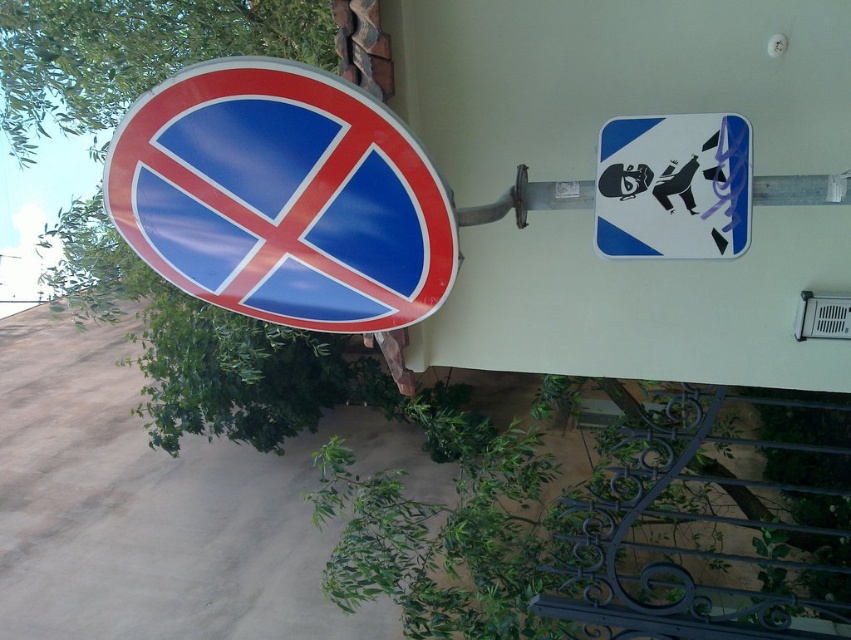
Question: Is shiny plastic sign at left further to the viewer compared to metallic pole at upper right?

Choices:
 (A) yes
 (B) no

Answer: (B)

Question: Does shiny plastic sign at left appear over blue glossy sign at upper right?

Choices:
 (A) no
 (B) yes

Answer: (A)

Question: Can you confirm if shiny plastic sign at left is bigger than metallic pole at upper right?

Choices:
 (A) yes
 (B) no

Answer: (A)

Question: Which object appears closest to the camera in this image?

Choices:
 (A) blue glossy sign at upper right
 (B) shiny plastic sign at left
 (C) metallic pole at upper right

Answer: (B)

Question: Estimate the real-world distances between objects in this image. Which object is closer to the metallic pole at upper right?

Choices:
 (A) blue glossy sign at upper right
 (B) shiny plastic sign at left

Answer: (A)

Question: Which point is farther to the camera?

Choices:
 (A) blue glossy sign at upper right
 (B) metallic pole at upper right

Answer: (B)